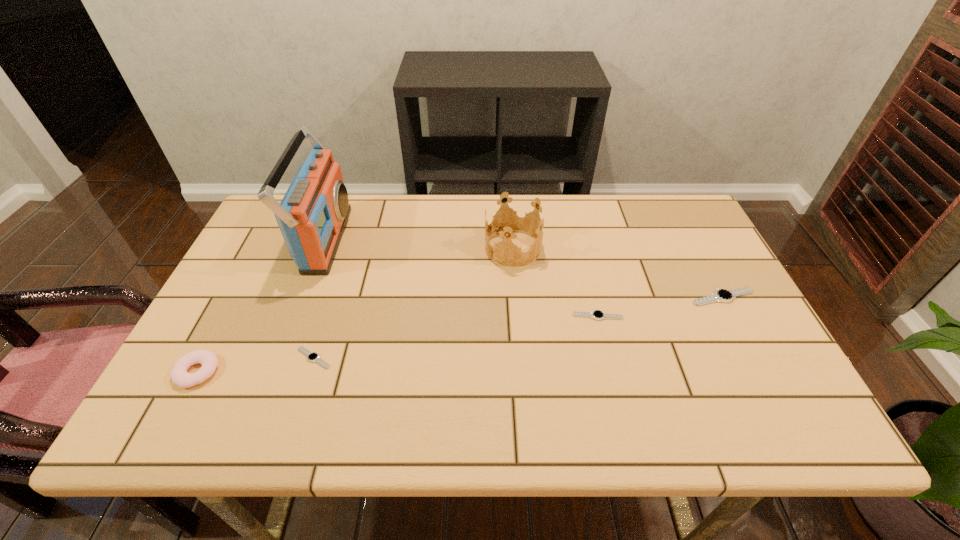
Find the location of a particular element. doughnut that is at the near edge is located at coordinates (179, 375).

Where is `radio receiver located in the left edge section of the desktop`? radio receiver located in the left edge section of the desktop is located at coordinates (312, 216).

Identify the location of doughnut at the left edge. (179, 375).

The image size is (960, 540). I want to click on object that is at the right edge, so click(x=721, y=295).

You are a GUI agent. You are given a task and a screenshot of the screen. Output one action in this format:
    pyautogui.click(x=<x>, y=<y>)
    Task: Click on the object that is at the far left corner
    Image resolution: width=960 pixels, height=540 pixels.
    Given the screenshot: What is the action you would take?
    pyautogui.click(x=312, y=216)

The height and width of the screenshot is (540, 960). In order to click on object at the near left corner in this screenshot , I will do `click(179, 375)`.

In the image, there is a desktop. Identify the location of vacant space at the far edge. This screenshot has width=960, height=540. (608, 217).

Where is `blank area at the near edge`? blank area at the near edge is located at coordinates (575, 380).

Locate an element on the screen. The image size is (960, 540). vacant space at the left edge of the desktop is located at coordinates (241, 346).

Identify the location of vacant space at the right edge. (743, 301).